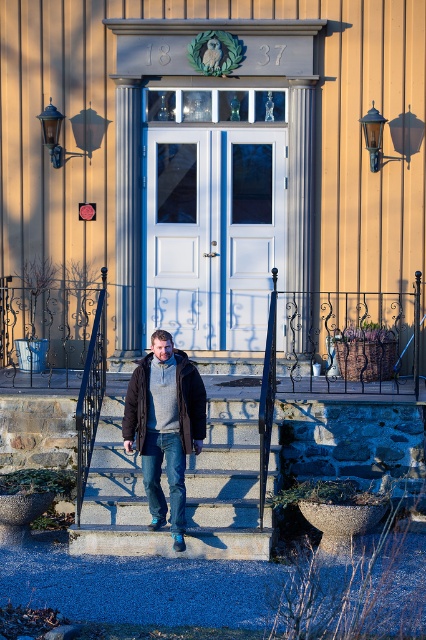
You are a delivery person trying to reach the entrance of the house. You see the concrete stairs at center and the dark gray woolen sweater at center. Which object is shorter in height?

The concrete stairs at center is not as tall as dark gray woolen sweater at center, so the concrete stairs at center is shorter in height.

Based on the photo, you are a photographer positioned at the camera. You want to take a closeup shot of the black matte jacket at center. Considering your current distance, would you need to move closer or farther away to achieve this?

The black matte jacket at center is 10.05 meters away from the camera. To take a closeup shot, you would need to move closer to reduce the distance between the camera and the jacket.

You are standing on the stone steps leading to the house entrance and want to place a small decoration between the two points marked as point [270,307] and point [135,417]. Which point is closer to you so you can place the decoration there first?

Point [270,307] is closer to you than point [135,417], so you should place the decoration near point [270,307] first.